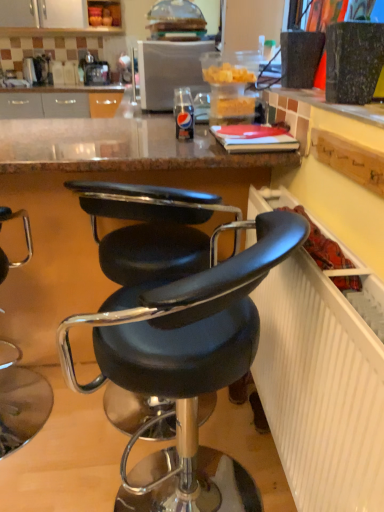
Question: Can you confirm if satin silver microwave at upper center is bigger than black leather stool at lower left, the second chair when ordered from right to left?

Choices:
 (A) yes
 (B) no

Answer: (B)

Question: From the image's perspective, would you say satin silver microwave at upper center is positioned over black leather stool at lower left, the second chair when ordered from right to left?

Choices:
 (A) yes
 (B) no

Answer: (A)

Question: Can you confirm if satin silver microwave at upper center is wider than black leather stool at lower left, the second chair when ordered from right to left?

Choices:
 (A) no
 (B) yes

Answer: (A)

Question: Considering the relative sizes of satin silver microwave at upper center and black leather stool at lower left, marked as the 1th chair in a left-to-right arrangement, in the image provided, is satin silver microwave at upper center thinner than black leather stool at lower left, marked as the 1th chair in a left-to-right arrangement,?

Choices:
 (A) yes
 (B) no

Answer: (A)

Question: Can you confirm if satin silver microwave at upper center is positioned to the left of black leather stool at lower left, marked as the 1th chair in a left-to-right arrangement?

Choices:
 (A) no
 (B) yes

Answer: (A)

Question: Are satin silver microwave at upper center and black leather stool at lower left, marked as the 1th chair in a left-to-right arrangement, located far from each other?

Choices:
 (A) no
 (B) yes

Answer: (B)

Question: Is white textured radiator at lower right looking in the opposite direction of black leather chair at center, positioned as the 2th chair in left-to-right order?

Choices:
 (A) no
 (B) yes

Answer: (B)

Question: From a real-world perspective, does white textured radiator at lower right sit lower than black leather chair at center, positioned as the 2th chair in left-to-right order?

Choices:
 (A) no
 (B) yes

Answer: (A)

Question: Is white textured radiator at lower right not within black leather chair at center, the 1th chair in the right-to-left sequence?

Choices:
 (A) no
 (B) yes

Answer: (B)

Question: Can you confirm if white textured radiator at lower right is positioned to the right of black leather chair at center, the 1th chair in the right-to-left sequence?

Choices:
 (A) no
 (B) yes

Answer: (B)

Question: Is white textured radiator at lower right positioned far away from black leather chair at center, positioned as the 2th chair in left-to-right order?

Choices:
 (A) no
 (B) yes

Answer: (A)

Question: Is the depth of white textured radiator at lower right less than that of black leather chair at center, the 1th chair in the right-to-left sequence?

Choices:
 (A) no
 (B) yes

Answer: (B)

Question: Does black leather chair at center, positioned as the 2th chair in left-to-right order, contain white textured radiator at lower right?

Choices:
 (A) no
 (B) yes

Answer: (A)